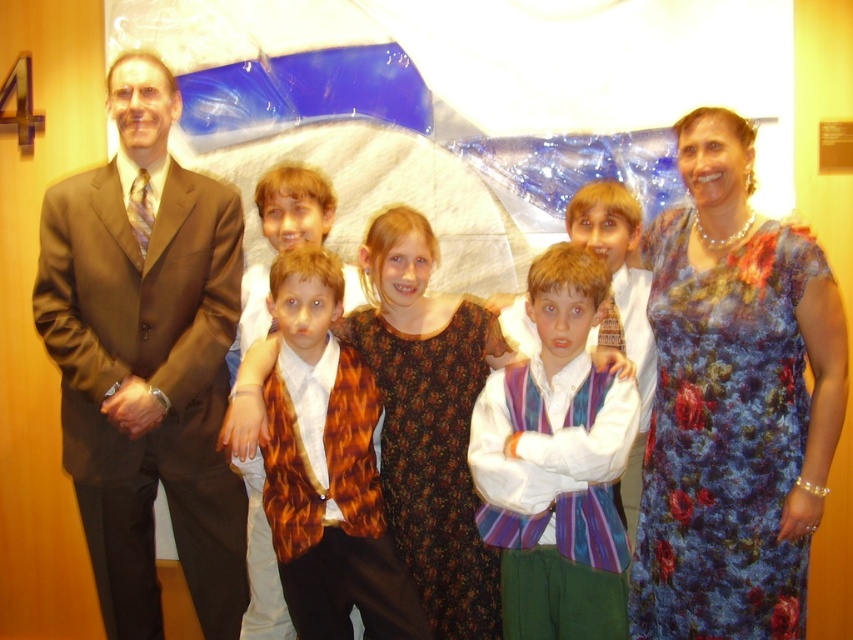
Question: Estimate the real-world distances between objects in this image. Which object is farther from the floral dress at center?

Choices:
 (A) brown suit at left
 (B) leopard print vest at center
 (C) floral silk dress at center
 (D) striped velvet vest at center

Answer: (A)

Question: Does brown suit at left appear on the left side of leopard print vest at center?

Choices:
 (A) yes
 (B) no

Answer: (A)

Question: Can you confirm if leopard print vest at center is positioned below floral dress at center?

Choices:
 (A) no
 (B) yes

Answer: (B)

Question: Does floral silk dress at center appear over striped velvet vest at center?

Choices:
 (A) yes
 (B) no

Answer: (A)

Question: Among these objects, which one is nearest to the camera?

Choices:
 (A) brown suit at left
 (B) striped velvet vest at center
 (C) floral dress at center
 (D) leopard print vest at center

Answer: (B)

Question: Among these points, which one is nearest to the camera?

Choices:
 (A) (351, 515)
 (B) (189, 324)
 (C) (457, 310)

Answer: (A)